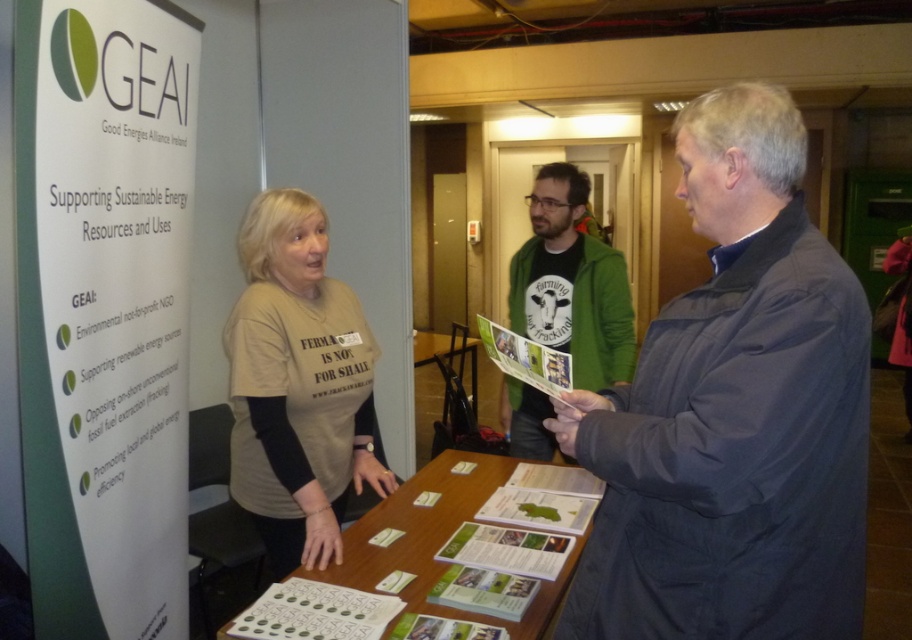
You are an event organizer at the GEAI informational event. You need to arrange a photo shoot where the dark blue jacket at center and the green fuzzy sweater at center must be visible. Since both are on the same person, which clothing item should be positioned higher to ensure both are visible in the photo?

The green fuzzy sweater at center should be positioned higher than the dark blue jacket at center because the dark blue jacket at center is currently located below the green fuzzy sweater at center.

You are a photographer at the event and want to take a photo of both the green fuzzy sweater at center and the green paper at center in the same frame. The camera you are using has a minimum focus distance of 65 centimeters. Will both objects be in focus if you position the camera exactly between them?

The green fuzzy sweater at center and green paper at center are 66.55 centimeters apart. Since the camera requires a minimum focus distance of 65 centimeters, positioning the camera exactly between them would mean each object is 33.275 centimeters away from the camera. This distance is within the camera s minimum focus range, so both objects will be in focus.

You are standing in the room and want to move from point A to point B. Point A is at coordinate point (558, 333) and point B is at coordinate point (385, 572). Which point is closer to you when you first enter the room?

Point A at coordinate point (558, 333) is closer to you because it is further to the camera than point B at coordinate point (385, 572).